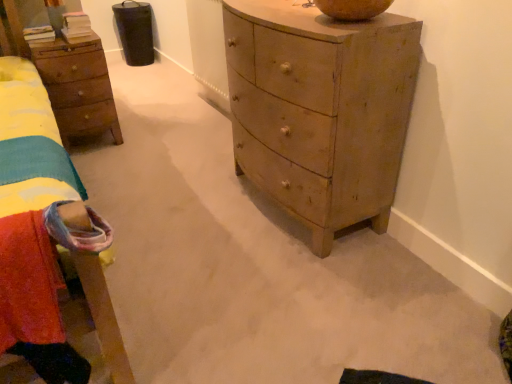
Question: In the image, is wooden nightstand at left positioned in front of or behind light brown wooden chest of drawers at center?

Choices:
 (A) behind
 (B) front

Answer: (A)

Question: From the image's perspective, is wooden nightstand at left located above or below light brown wooden chest of drawers at center?

Choices:
 (A) below
 (B) above

Answer: (B)

Question: Estimate the real-world distances between objects in this image. Which object is farther from the velvety red blanket at lower left?

Choices:
 (A) light brown wooden chest of drawers at center
 (B) wooden nightstand at left

Answer: (A)

Question: Which of these objects is positioned closest to the light brown wooden chest of drawers at center?

Choices:
 (A) velvety red blanket at lower left
 (B) wooden nightstand at left

Answer: (A)